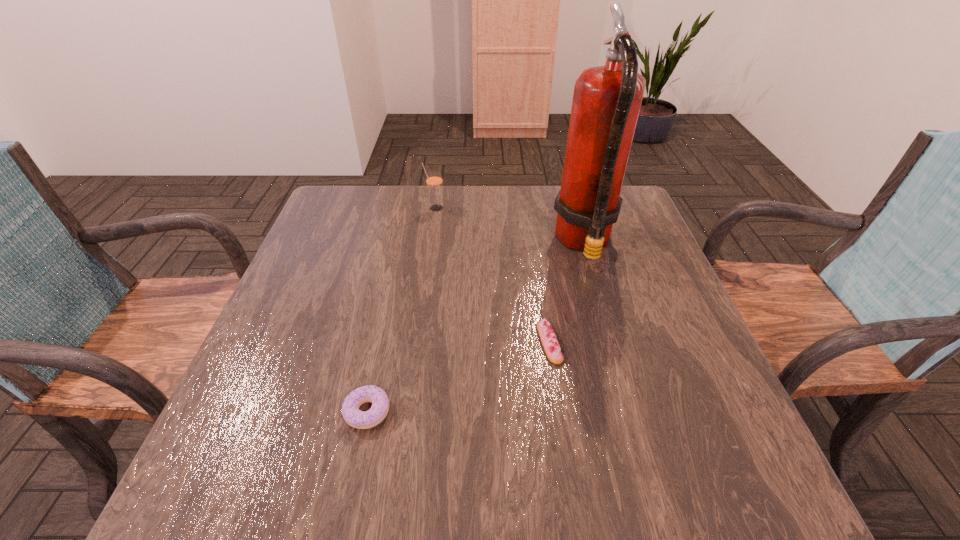
At what (x,y) coordinates should I click in order to perform the action: click on the rightmost object. Please return your answer as a coordinate pair (x, y). The width and height of the screenshot is (960, 540). Looking at the image, I should click on 606,103.

I want to click on fire extinguisher, so click(606, 103).

What are the coordinates of `the third object from right to left` in the screenshot? It's located at (434, 181).

Locate an element on the screen. the third shortest object is located at coordinates (434, 181).

Locate an element on the screen. the leftmost object is located at coordinates (354, 417).

Identify the location of the nearest object. This screenshot has width=960, height=540. point(354,417).

The height and width of the screenshot is (540, 960). I want to click on the third object from left to right, so click(x=548, y=338).

Locate an element on the screen. The width and height of the screenshot is (960, 540). the third farthest object is located at coordinates (548, 338).

You are a GUI agent. You are given a task and a screenshot of the screen. Output one action in this format:
    pyautogui.click(x=<x>, y=<y>)
    Task: Click on the free space located 0.140m at the nozzle of the fire extinguisher
    This screenshot has height=540, width=960.
    Given the screenshot: What is the action you would take?
    pyautogui.click(x=499, y=242)

This screenshot has width=960, height=540. I want to click on blank space located at the nozzle of the fire extinguisher, so click(465, 242).